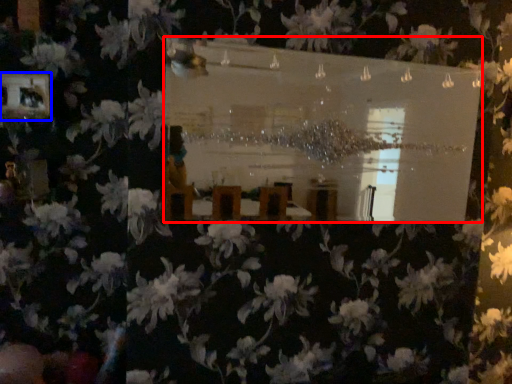
Question: Among these objects, which one is nearest to the camera, mirror (highlighted by a red box) or picture frame (highlighted by a blue box)?

Choices:
 (A) mirror
 (B) picture frame

Answer: (A)